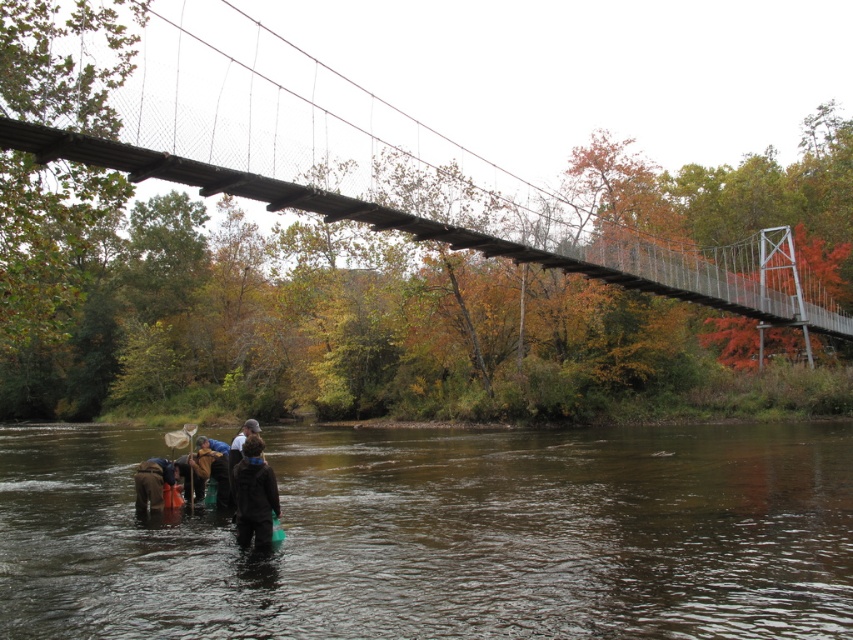
Between dark brown leather boots at lower left and brown fabric at lower left, which one is positioned lower?

brown fabric at lower left is lower down.

Is point (227, 481) positioned in front of point (135, 499)?

Yes.

The height and width of the screenshot is (640, 853). In order to click on dark brown leather boots at lower left in this screenshot , I will do `click(242, 484)`.

Is brown murky water at lower center smaller than brown fabric at lower left?

No.

At what (x,y) coordinates should I click in order to perform the action: click on brown murky water at lower center. Please return your answer as a coordinate pair (x, y). The height and width of the screenshot is (640, 853). Looking at the image, I should click on (444, 536).

I want to click on brown murky water at lower center, so click(x=444, y=536).

Between point (270, 502) and point (167, 468), which one is positioned in front?

Point (270, 502) is more forward.

Does dark brown jacket at lower center have a greater height compared to brown fabric at lower left?

Yes, dark brown jacket at lower center is taller than brown fabric at lower left.

You are a GUI agent. You are given a task and a screenshot of the screen. Output one action in this format:
    pyautogui.click(x=<x>, y=<y>)
    Task: Click on the dark brown jacket at lower center
    
    Given the screenshot: What is the action you would take?
    pyautogui.click(x=253, y=493)